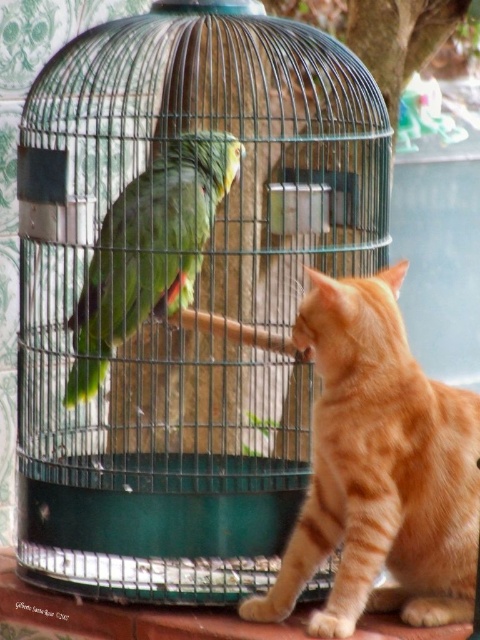
You are a small toy mouse. You want to move from the orange tabby cat at right to the green matte parrot at center. Which direction should you move to get closer to the parrot?

The orange tabby cat at right is closer to the viewer than the green matte parrot at center. To move closer to the parrot, you should move backward away from the viewer towards the cage.

You are a robotic arm that needs to place a 50 cm long toy between the orange tabby cat at right and the green matte parrot at center. Can you fit the toy between them without touching either?

The orange tabby cat at right is 51.14 centimeters away from the green matte parrot at center. Since the toy is 50 cm long, it can be placed between them without touching either as there is enough space.